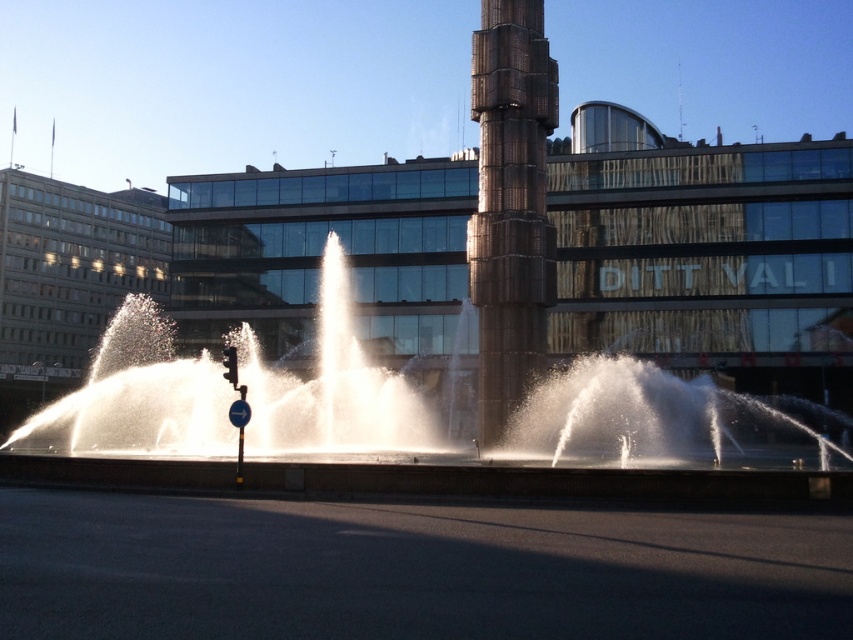
Question: Which point is farther from the camera taking this photo?

Choices:
 (A) (292, 445)
 (B) (520, 195)

Answer: (A)

Question: Is white water at center smaller than rustic metal column at center?

Choices:
 (A) no
 (B) yes

Answer: (A)

Question: Is the position of white water at center less distant than that of rustic metal column at center?

Choices:
 (A) yes
 (B) no

Answer: (A)

Question: Does white water at center have a smaller size compared to rustic metal column at center?

Choices:
 (A) yes
 (B) no

Answer: (B)